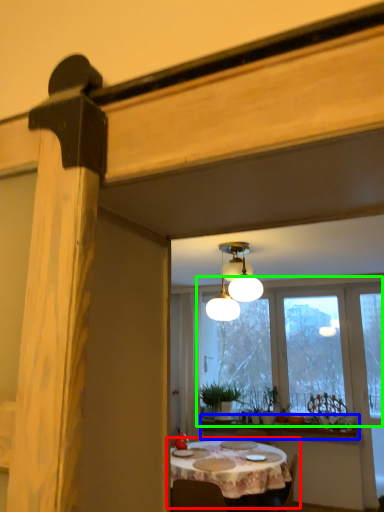
Question: Considering the real-world distances, which object is farthest from kitchen & dining room table (highlighted by a red box)? window sill (highlighted by a blue box) or window (highlighted by a green box)?

Choices:
 (A) window sill
 (B) window

Answer: (B)